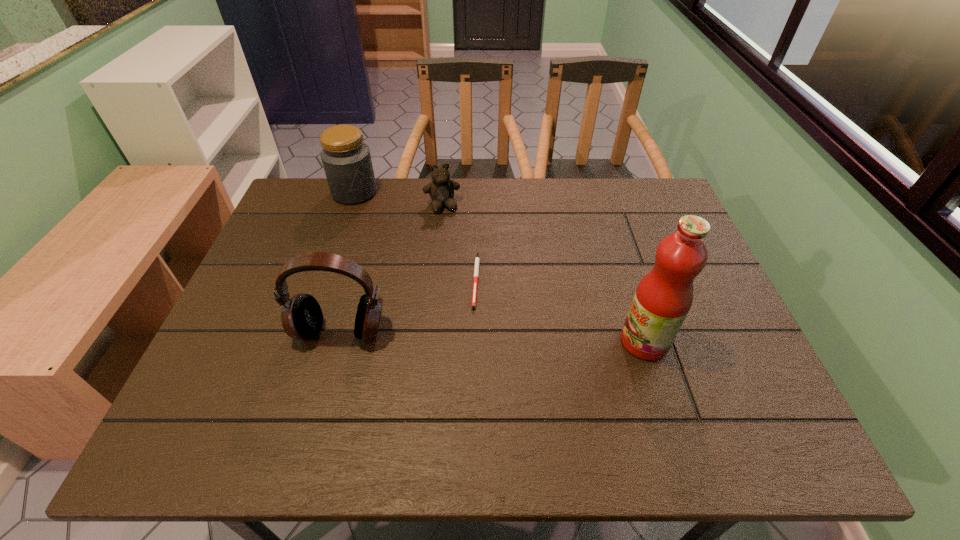
Where is `headset`? Image resolution: width=960 pixels, height=540 pixels. headset is located at coordinates (301, 315).

Where is `the rightmost object`? The image size is (960, 540). the rightmost object is located at coordinates (663, 298).

Locate an element on the screen. the tallest object is located at coordinates (663, 298).

You are a GUI agent. You are given a task and a screenshot of the screen. Output one action in this format:
    pyautogui.click(x=<x>, y=<y>)
    Task: Click on the third object from right to left
    
    Given the screenshot: What is the action you would take?
    pyautogui.click(x=441, y=190)

Find the location of a particular element. The height and width of the screenshot is (540, 960). the second shortest object is located at coordinates (441, 190).

Identify the location of the fourth object from left to right. The height and width of the screenshot is (540, 960). (476, 270).

Find the location of a particular element. This screenshot has width=960, height=540. the third farthest object is located at coordinates (476, 270).

You are a GUI agent. You are given a task and a screenshot of the screen. Output one action in this format:
    pyautogui.click(x=<x>, y=<y>)
    Task: Click on the jar
    The image size is (960, 540).
    Given the screenshot: What is the action you would take?
    pyautogui.click(x=346, y=159)

Identify the location of vacant space situated on the ear pads of the headset. The height and width of the screenshot is (540, 960). (323, 399).

Where is `vacant space located 0.080m on the front label of the fruit juice`? vacant space located 0.080m on the front label of the fruit juice is located at coordinates (586, 341).